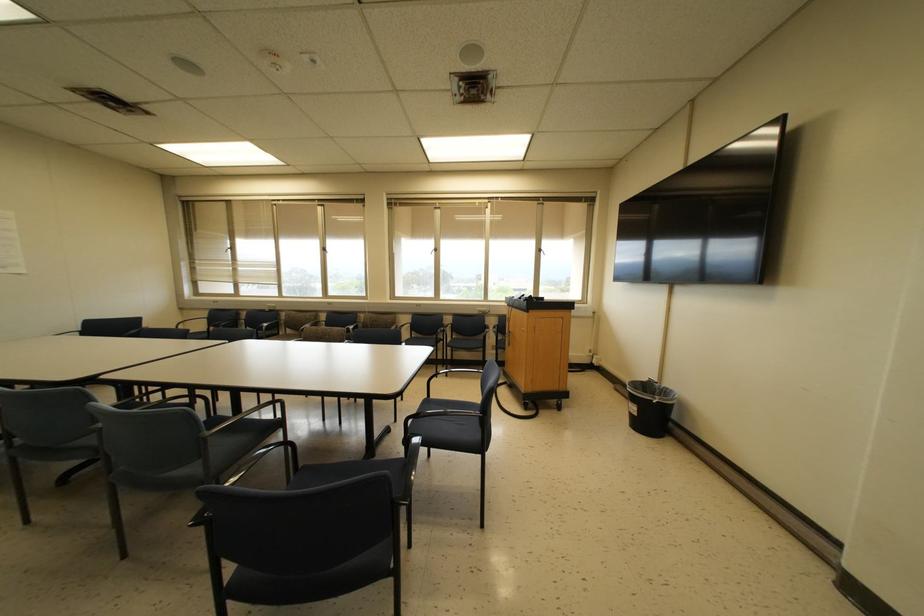
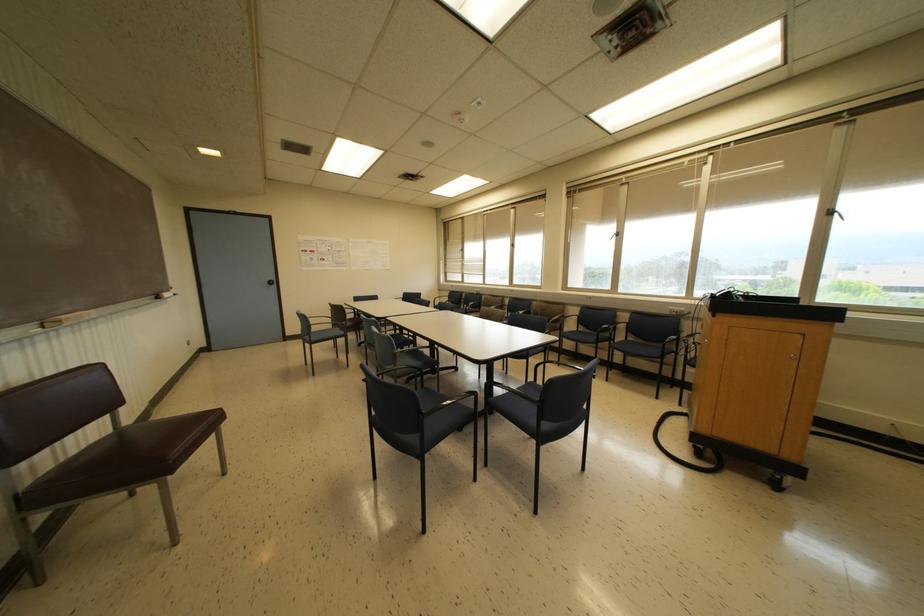
Find the pixel in the second image that matches [435,249] in the first image.

(617, 233)